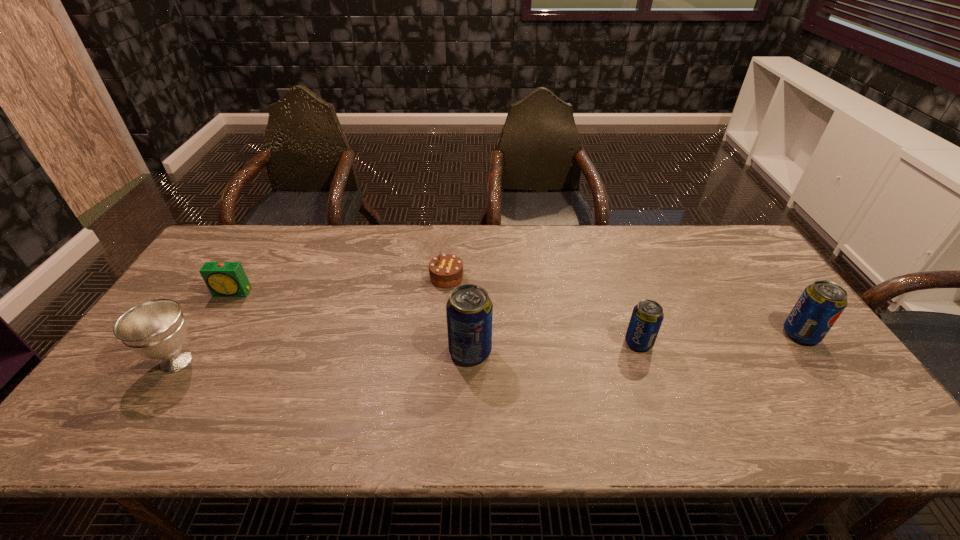
All sodas are currently evenly spaced. To continue this pattern, where would you add another soda on the left? Please point out a vacant spot. Please provide its 2D coordinates. Your answer should be formatted as a tuple, i.e. [(x, y)], where the tuple contains the x and y coordinates of a point satisfying the conditions above.

[(296, 360)]